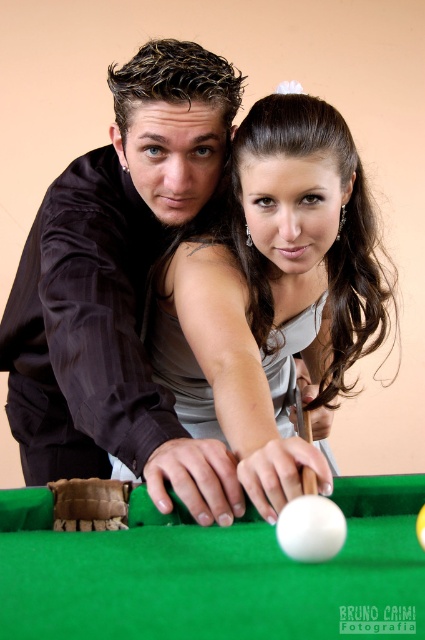
Question: Among these objects, which one is farthest from the camera?

Choices:
 (A) white matte cue at center
 (B) satin black shirt at center
 (C) satin silver dress at center
 (D) green felt billiard table at center

Answer: (A)

Question: Can you confirm if satin silver dress at center is positioned below green felt billiard table at center?

Choices:
 (A) no
 (B) yes

Answer: (A)

Question: Does satin silver dress at center have a larger size compared to green felt billiard table at center?

Choices:
 (A) yes
 (B) no

Answer: (A)

Question: Does satin black shirt at center have a larger size compared to white matte cue at center?

Choices:
 (A) no
 (B) yes

Answer: (B)

Question: Which object appears closest to the camera in this image?

Choices:
 (A) satin silver dress at center
 (B) white matte cue at center
 (C) green felt billiard table at center
 (D) satin black shirt at center

Answer: (C)

Question: Which object is closer to the camera taking this photo?

Choices:
 (A) satin silver dress at center
 (B) green felt billiard table at center
 (C) satin black shirt at center

Answer: (B)